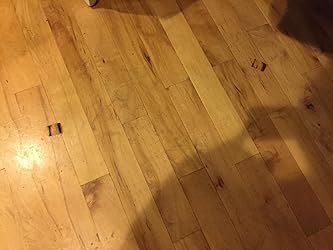
Find the location of a particular element. The height and width of the screenshot is (250, 333). wood planks is located at coordinates (31, 108), (65, 108), (95, 92), (115, 84), (143, 137), (177, 136), (207, 195), (198, 133), (227, 109), (249, 169).